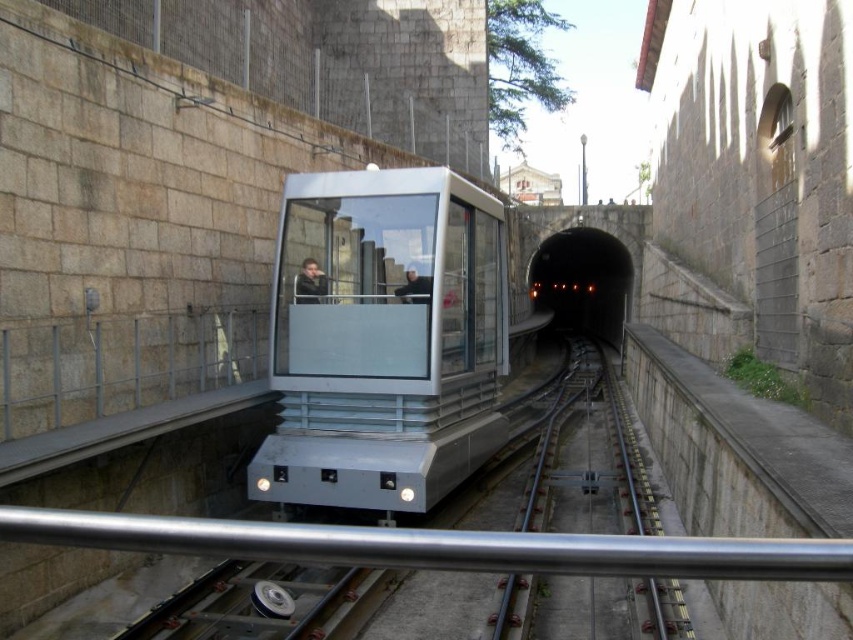
Which is above, metallic silver tram at center or metal/smooth train track at center?

metallic silver tram at center

Is metallic silver tram at center smaller than metal/smooth train track at center?

Yes, metallic silver tram at center is smaller than metal/smooth train track at center.

Which is behind, point (477, 284) or point (630, 612)?

The point (477, 284) is more distant.

At what (x,y) coordinates should I click in order to perform the action: click on metallic silver tram at center. Please return your answer as a coordinate pair (x, y). Looking at the image, I should click on (383, 339).

Is metallic silver tram at center wider than black concrete tunnel at center?

Incorrect, metallic silver tram at center's width does not surpass black concrete tunnel at center's.

This screenshot has height=640, width=853. I want to click on metallic silver tram at center, so click(383, 339).

Is point (369, 429) more distant than point (576, 259)?

No, it is in front of (576, 259).

You are a GUI agent. You are given a task and a screenshot of the screen. Output one action in this format:
    pyautogui.click(x=<x>, y=<y>)
    Task: Click on the metallic silver tram at center
    The width and height of the screenshot is (853, 640).
    Given the screenshot: What is the action you would take?
    pyautogui.click(x=383, y=339)

Is metal/smooth train track at center smaller than black concrete tunnel at center?

Yes, metal/smooth train track at center is smaller than black concrete tunnel at center.

Can you confirm if metal/smooth train track at center is taller than black concrete tunnel at center?

No.

Which is behind, point (508, 592) or point (556, 276)?

The point (556, 276) is more distant.

At what (x,y) coordinates should I click in order to perform the action: click on metal/smooth train track at center. Please return your answer as a coordinate pair (x, y). This screenshot has height=640, width=853. Looking at the image, I should click on (589, 460).